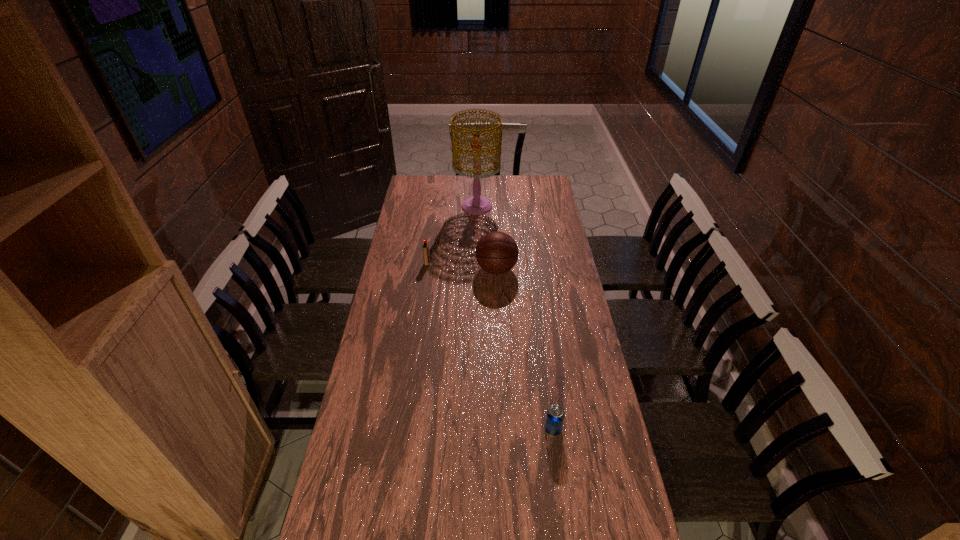
The width and height of the screenshot is (960, 540). What are the coordinates of `lampshade` in the screenshot? It's located at click(x=476, y=205).

Image resolution: width=960 pixels, height=540 pixels. Find the location of `the farthest object`. the farthest object is located at coordinates (476, 205).

Where is `the third shortest object`? The width and height of the screenshot is (960, 540). the third shortest object is located at coordinates (496, 252).

In order to click on igniter in this screenshot , I will do `click(426, 255)`.

This screenshot has height=540, width=960. I want to click on the leftmost object, so click(x=426, y=255).

Identify the location of the rightmost object. Image resolution: width=960 pixels, height=540 pixels. (555, 415).

The image size is (960, 540). I want to click on beer can, so click(555, 415).

What are the coordinates of `free space located on the front of the tallest object` in the screenshot? It's located at (476, 227).

Find the location of a particular element. blank space located on the left of the basketball is located at coordinates (388, 269).

At what (x,y) coordinates should I click in order to perform the action: click on vacant space located on the front of the igniter. Please return your answer as a coordinate pair (x, y). Looking at the image, I should click on (425, 275).